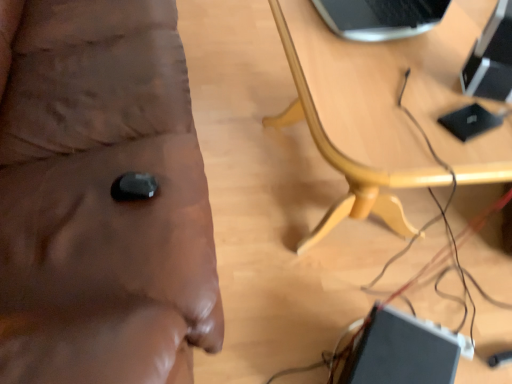
At what (x,y) coordinates should I click in order to perform the action: click on blank space situated above black glossy laptop at lower right (from a real-world perspective). Please return your answer as a coordinate pair (x, y). Looking at the image, I should click on (407, 352).